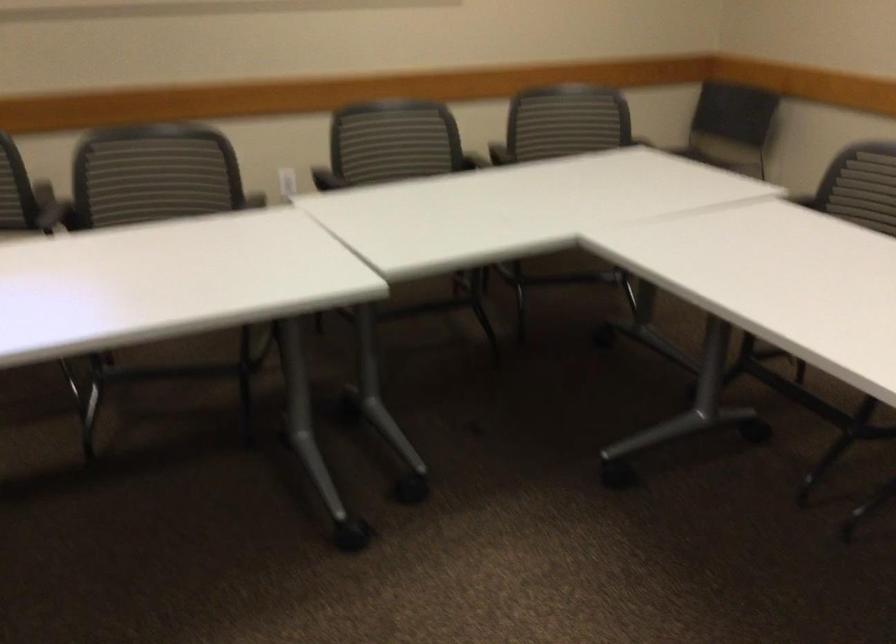
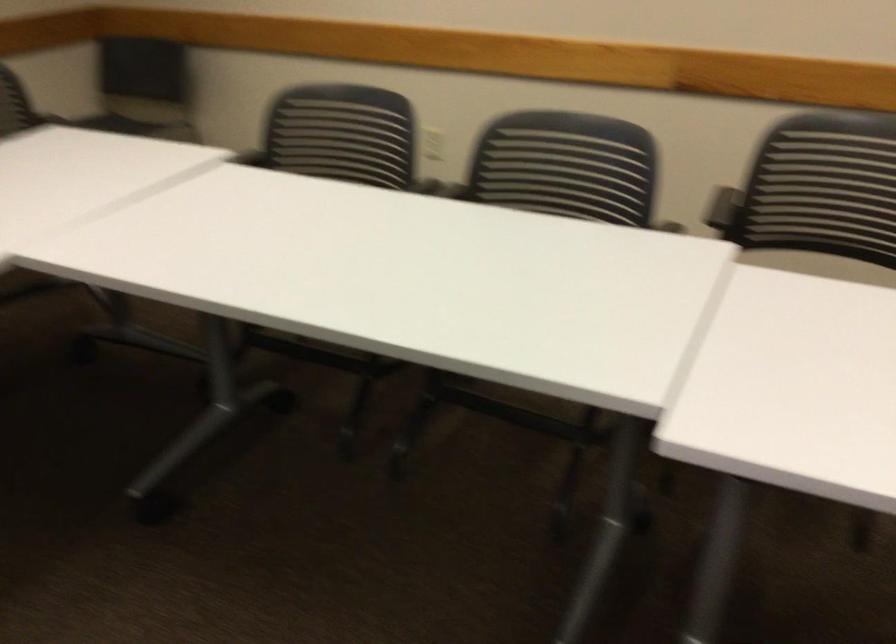
Question: How did the camera likely rotate?

Choices:
 (A) Left
 (B) Right
 (C) Up
 (D) Down

Answer: (B)